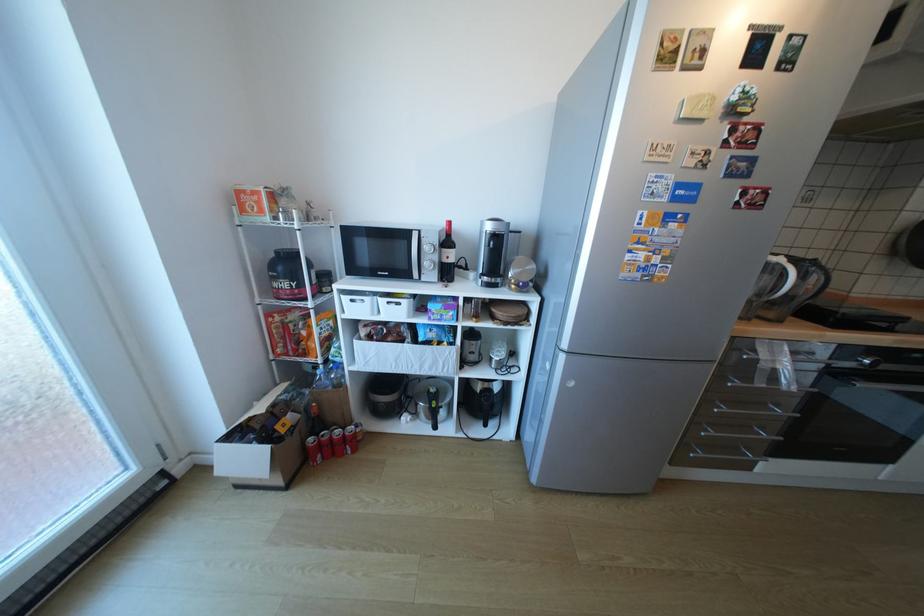
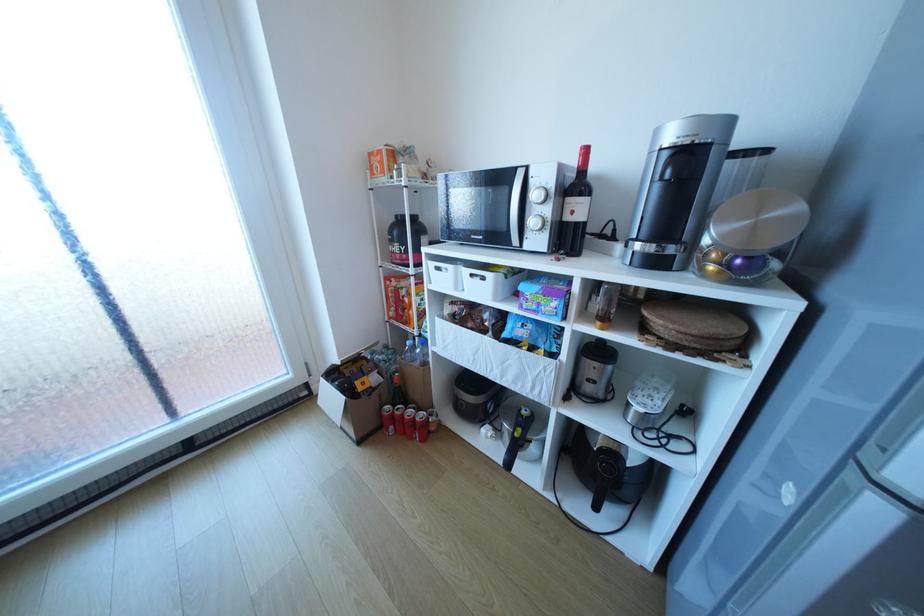
Where in the second image is the point corresponding to (428,413) from the first image?

(513, 434)